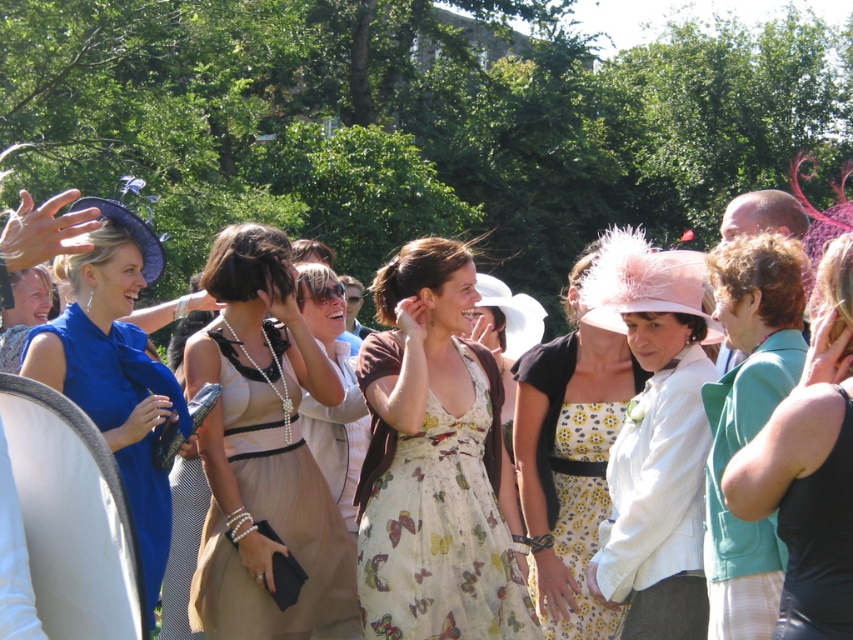
At what (x,y) coordinates should I click in order to perform the action: click on floral print dress at center. Please return your answer as a coordinate pair (x, y). This screenshot has width=853, height=640. Looking at the image, I should click on tap(569, 467).

Who is shorter, floral print dress at center or matte blue dress at left?

Standing shorter between the two is matte blue dress at left.

Which is in front, point (602, 358) or point (84, 376)?

Point (84, 376)

Locate an element on the screen. floral print dress at center is located at coordinates (569, 467).

Who is positioned more to the right, green fabric shirt at right or matte blue dress at left?

From the viewer's perspective, green fabric shirt at right appears more on the right side.

How far apart are green fabric shirt at right and matte blue dress at left?

4.36 meters

Does point (843, 547) come closer to viewer compared to point (142, 500)?

That is True.

You are a GUI agent. You are given a task and a screenshot of the screen. Output one action in this format:
    pyautogui.click(x=<x>, y=<y>)
    Task: Click on the green fabric shirt at right
    The image size is (853, 640).
    Given the screenshot: What is the action you would take?
    pyautogui.click(x=809, y=467)

Can you confirm if butterfly-patterned fabric dress at center is wider than black satin dress at lower right?

Yes, butterfly-patterned fabric dress at center is wider than black satin dress at lower right.

Which is more to the left, butterfly-patterned fabric dress at center or black satin dress at lower right?

Positioned to the left is butterfly-patterned fabric dress at center.

Find the location of a particular element. butterfly-patterned fabric dress at center is located at coordinates (437, 515).

You are a GUI agent. You are given a task and a screenshot of the screen. Output one action in this format:
    pyautogui.click(x=<x>, y=<y>)
    Task: Click on the butterfly-patterned fabric dress at center
    
    Given the screenshot: What is the action you would take?
    pyautogui.click(x=437, y=515)